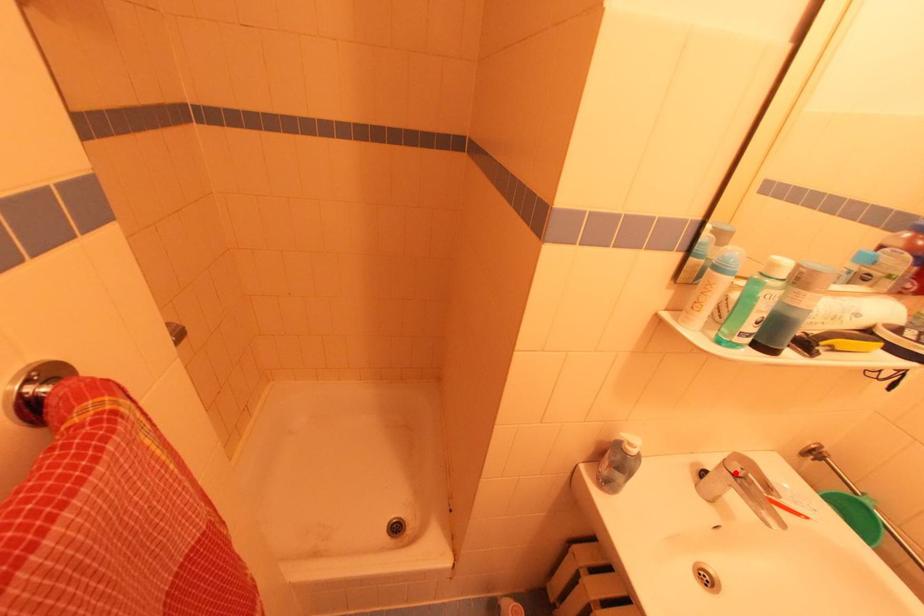
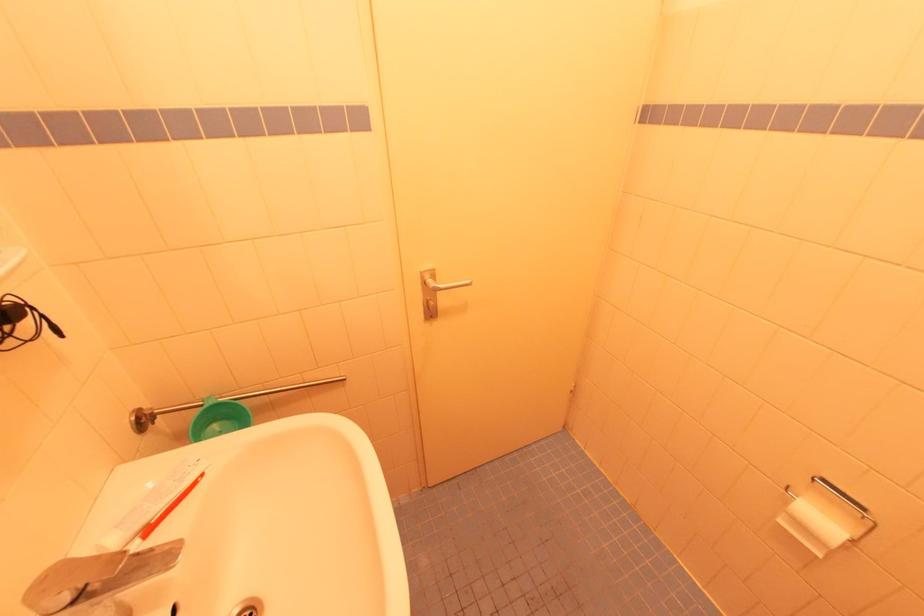
Question: I am providing you with two images of the same scene from different viewpoints. A red point is shown in image1. For the corresponding object point in image2, is it positioned nearer or farther from the camera?

Choices:
 (A) Nearer
 (B) Farther

Answer: (A)